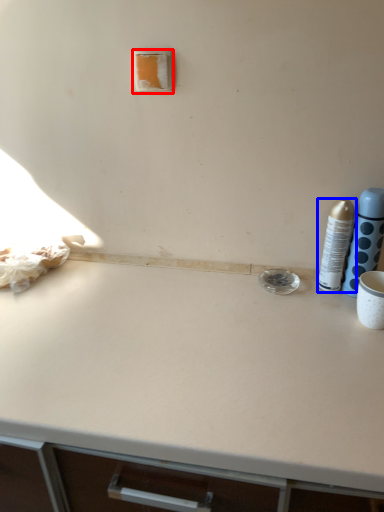
Question: Among these objects, which one is nearest to the camera, light switch (highlighted by a red box) or bottle (highlighted by a blue box)?

Choices:
 (A) light switch
 (B) bottle

Answer: (B)